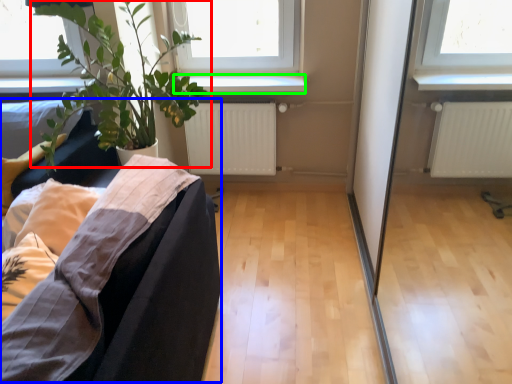
Question: Based on their relative distances, which object is farther from houseplant (highlighted by a red box)? Choose from couch (highlighted by a blue box) and window sill (highlighted by a green box).

Choices:
 (A) couch
 (B) window sill

Answer: (A)